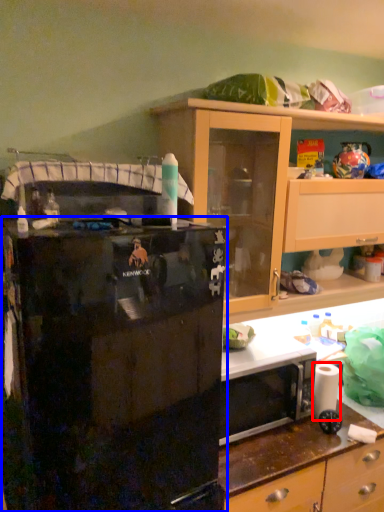
Question: Which object appears farthest to the camera in this image, toilet paper (highlighted by a red box) or refrigerator (highlighted by a blue box)?

Choices:
 (A) toilet paper
 (B) refrigerator

Answer: (A)